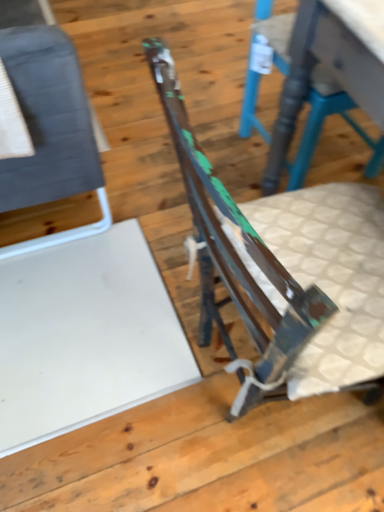
What do you see at coordinates (50, 131) in the screenshot?
I see `matte gray fabric chair at left, which is the first chair from left to right` at bounding box center [50, 131].

Image resolution: width=384 pixels, height=512 pixels. In order to click on rusty metal chair at center, positioned as the 2th chair in left-to-right order in this screenshot , I will do `click(236, 259)`.

Is rusty metal chair at center, placed as the 2th chair when sorted from right to left, wider than matte gray fabric chair at left, the third chair when ordered from right to left?

Indeed, rusty metal chair at center, placed as the 2th chair when sorted from right to left, has a greater width compared to matte gray fabric chair at left, the third chair when ordered from right to left.

Is rusty metal chair at center, positioned as the 2th chair in left-to-right order, far from matte gray fabric chair at left, which is the first chair from left to right?

rusty metal chair at center, positioned as the 2th chair in left-to-right order, is actually quite close to matte gray fabric chair at left, which is the first chair from left to right.

Is rusty metal chair at center, placed as the 2th chair when sorted from right to left, in front of or behind matte gray fabric chair at left, the third chair when ordered from right to left, in the image?

Visually, rusty metal chair at center, placed as the 2th chair when sorted from right to left, is located in front of matte gray fabric chair at left, the third chair when ordered from right to left.

Looking at this image, visually, is rusty metal chair at center, positioned as the 2th chair in left-to-right order, positioned to the left or to the right of matte gray fabric chair at left, which is the first chair from left to right?

From the image, it's evident that rusty metal chair at center, positioned as the 2th chair in left-to-right order, is to the right of matte gray fabric chair at left, which is the first chair from left to right.

Can you confirm if rusty metal chair at center, positioned as the 2th chair in left-to-right order, is wider than rustic wood chair at center, which is the 1th chair from right to left?

Yes.

Is rusty metal chair at center, placed as the 2th chair when sorted from right to left, to the right of rustic wood chair at center, arranged as the 3th chair when viewed from the left, from the viewer's perspective?

No.

From the picture: From a real-world perspective, does rusty metal chair at center, positioned as the 2th chair in left-to-right order, sit lower than rustic wood chair at center, which is the 1th chair from right to left?

Incorrect, from a real-world perspective, rusty metal chair at center, positioned as the 2th chair in left-to-right order, is higher than rustic wood chair at center, which is the 1th chair from right to left.

Which object is positioned more to the left, matte gray fabric chair at left, which is the first chair from left to right, or rusty metal chair at center, positioned as the 2th chair in left-to-right order?

matte gray fabric chair at left, which is the first chair from left to right.

Is matte gray fabric chair at left, which is the first chair from left to right, facing towards rusty metal chair at center, placed as the 2th chair when sorted from right to left?

No.

Would you consider matte gray fabric chair at left, which is the first chair from left to right, to be distant from rusty metal chair at center, placed as the 2th chair when sorted from right to left?

No, matte gray fabric chair at left, which is the first chair from left to right, is not far from rusty metal chair at center, placed as the 2th chair when sorted from right to left.

Can you confirm if matte gray fabric chair at left, which is the first chair from left to right, is shorter than rusty metal chair at center, placed as the 2th chair when sorted from right to left?

Yes.

Which object is positioned more to the left, rustic wood chair at center, which is the 1th chair from right to left, or matte gray fabric chair at left, the third chair when ordered from right to left?

Positioned to the left is matte gray fabric chair at left, the third chair when ordered from right to left.

From a real-world perspective, is rustic wood chair at center, which is the 1th chair from right to left, positioned above or below matte gray fabric chair at left, the third chair when ordered from right to left?

rustic wood chair at center, which is the 1th chair from right to left, is below matte gray fabric chair at left, the third chair when ordered from right to left.

From the image's perspective, is rustic wood chair at center, which is the 1th chair from right to left, on top of matte gray fabric chair at left, which is the first chair from left to right?

No, from the image's perspective, rustic wood chair at center, which is the 1th chair from right to left, is not above matte gray fabric chair at left, which is the first chair from left to right.

Considering the points (274, 178) and (26, 65), which point is in front, point (274, 178) or point (26, 65)?

The point (26, 65) is closer.

Which point is more forward, [289,135] or [291,353]?

Positioned in front is point [291,353].

Is rustic wood chair at center, arranged as the 3th chair when viewed from the left, facing away from rusty metal chair at center, placed as the 2th chair when sorted from right to left?

That's not correct — rustic wood chair at center, arranged as the 3th chair when viewed from the left, is not looking away from rusty metal chair at center, placed as the 2th chair when sorted from right to left.

Considering the relative sizes of rustic wood chair at center, which is the 1th chair from right to left, and rusty metal chair at center, positioned as the 2th chair in left-to-right order, in the image provided, is rustic wood chair at center, which is the 1th chair from right to left, smaller than rusty metal chair at center, positioned as the 2th chair in left-to-right order,?

Indeed, rustic wood chair at center, which is the 1th chair from right to left, has a smaller size compared to rusty metal chair at center, positioned as the 2th chair in left-to-right order.

From the picture: Considering the relative positions of rustic wood chair at center, arranged as the 3th chair when viewed from the left, and rusty metal chair at center, positioned as the 2th chair in left-to-right order, in the image provided, is rustic wood chair at center, arranged as the 3th chair when viewed from the left, to the left of rusty metal chair at center, positioned as the 2th chair in left-to-right order, from the viewer's perspective?

No, rustic wood chair at center, arranged as the 3th chair when viewed from the left, is not to the left of rusty metal chair at center, positioned as the 2th chair in left-to-right order.

How many degrees apart are the facing directions of matte gray fabric chair at left, the third chair when ordered from right to left, and rustic wood chair at center, which is the 1th chair from right to left?

The angular difference between matte gray fabric chair at left, the third chair when ordered from right to left, and rustic wood chair at center, which is the 1th chair from right to left, is 89.5 degrees.

Who is bigger, matte gray fabric chair at left, the third chair when ordered from right to left, or rustic wood chair at center, arranged as the 3th chair when viewed from the left?

matte gray fabric chair at left, the third chair when ordered from right to left, is bigger.

Is matte gray fabric chair at left, which is the first chair from left to right, wider than rustic wood chair at center, which is the 1th chair from right to left?

In fact, matte gray fabric chair at left, which is the first chair from left to right, might be narrower than rustic wood chair at center, which is the 1th chair from right to left.

Starting from the rustic wood chair at center, which is the 1th chair from right to left, which chair is the 1st one in front? Please provide its 2D coordinates.

[(50, 131)]

From the image's perspective, starting from the rusty metal chair at center, placed as the 2th chair when sorted from right to left, which chair is the 2nd one above? Please provide its 2D coordinates.

[(50, 131)]

I want to click on the 2nd chair behind the rusty metal chair at center, placed as the 2th chair when sorted from right to left, so click(305, 95).

Estimate the real-world distances between objects in this image. Which object is closer to rusty metal chair at center, positioned as the 2th chair in left-to-right order, rustic wood chair at center, which is the 1th chair from right to left, or matte gray fabric chair at left, the third chair when ordered from right to left?

matte gray fabric chair at left, the third chair when ordered from right to left.

From the image, which object appears to be farther from matte gray fabric chair at left, the third chair when ordered from right to left, rusty metal chair at center, placed as the 2th chair when sorted from right to left, or rustic wood chair at center, which is the 1th chair from right to left?

rustic wood chair at center, which is the 1th chair from right to left, is further to matte gray fabric chair at left, the third chair when ordered from right to left.

When comparing their distances from rustic wood chair at center, which is the 1th chair from right to left, does rusty metal chair at center, positioned as the 2th chair in left-to-right order, or matte gray fabric chair at left, the third chair when ordered from right to left, seem closer?

rusty metal chair at center, positioned as the 2th chair in left-to-right order, is positioned closer to the anchor rustic wood chair at center, which is the 1th chair from right to left.

When comparing their distances from matte gray fabric chair at left, the third chair when ordered from right to left, does rustic wood chair at center, arranged as the 3th chair when viewed from the left, or rusty metal chair at center, placed as the 2th chair when sorted from right to left, seem closer?

The object closer to matte gray fabric chair at left, the third chair when ordered from right to left, is rusty metal chair at center, placed as the 2th chair when sorted from right to left.

Looking at the image, which one is located closer to rustic wood chair at center, which is the 1th chair from right to left, matte gray fabric chair at left, the third chair when ordered from right to left, or rusty metal chair at center, positioned as the 2th chair in left-to-right order?

rusty metal chair at center, positioned as the 2th chair in left-to-right order.

Consider the image. Considering their positions, is matte gray fabric chair at left, which is the first chair from left to right, positioned closer to rusty metal chair at center, placed as the 2th chair when sorted from right to left, than rustic wood chair at center, arranged as the 3th chair when viewed from the left?

Among the two, matte gray fabric chair at left, which is the first chair from left to right, is located nearer to rusty metal chair at center, placed as the 2th chair when sorted from right to left.

Where is `chair between matte gray fabric chair at left, the third chair when ordered from right to left, and rustic wood chair at center, which is the 1th chair from right to left, in the horizontal direction`? Image resolution: width=384 pixels, height=512 pixels. chair between matte gray fabric chair at left, the third chair when ordered from right to left, and rustic wood chair at center, which is the 1th chair from right to left, in the horizontal direction is located at coordinates (236, 259).